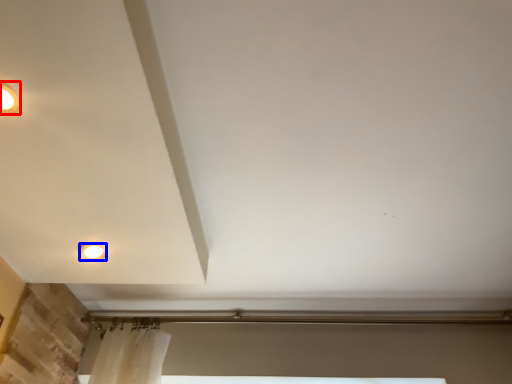
Question: Which object is further to the camera taking this photo, lighting (highlighted by a red box) or lamp (highlighted by a blue box)?

Choices:
 (A) lighting
 (B) lamp

Answer: (B)